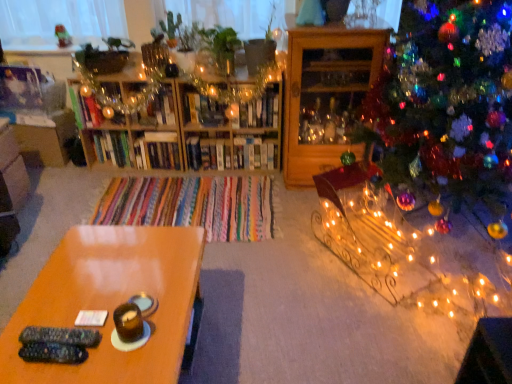
You are a GUI agent. You are given a task and a screenshot of the screen. Output one action in this format:
    pyautogui.click(x=<x>, y=<y>)
    Task: Click on the unoccupied area in front of wooden cabinet at right, the 3th shelf in the left-to-right sequence
    This screenshot has width=512, height=384.
    Given the screenshot: What is the action you would take?
    pyautogui.click(x=285, y=208)